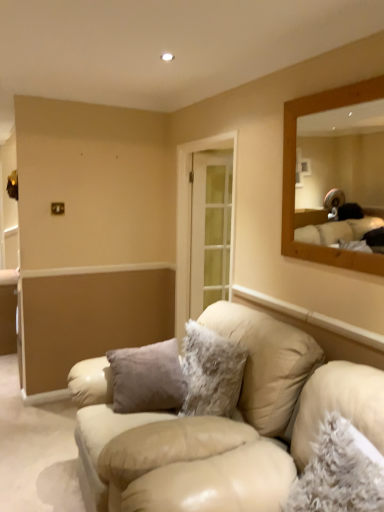
Question: From the image's perspective, is fuzzy gray pillow at lower right, the first pillow in the front-to-back sequence, under beige leather couch at center?

Choices:
 (A) yes
 (B) no

Answer: (B)

Question: From a real-world perspective, is fuzzy gray pillow at lower right, which is counted as the 2th pillow, starting from the left, located higher than beige leather couch at center?

Choices:
 (A) yes
 (B) no

Answer: (A)

Question: Is fuzzy gray pillow at lower right, positioned as the 1th pillow in right-to-left order, facing away from beige leather couch at center?

Choices:
 (A) no
 (B) yes

Answer: (A)

Question: Does fuzzy gray pillow at lower right, the first pillow in the front-to-back sequence, have a lesser width compared to beige leather couch at center?

Choices:
 (A) yes
 (B) no

Answer: (A)

Question: Considering the relative sizes of fuzzy gray pillow at lower right, which is counted as the 2th pillow, starting from the left, and beige leather couch at center in the image provided, is fuzzy gray pillow at lower right, which is counted as the 2th pillow, starting from the left, shorter than beige leather couch at center?

Choices:
 (A) yes
 (B) no

Answer: (A)

Question: From the image's perspective, relative to fuzzy gray pillow at lower right, the first pillow in the front-to-back sequence, is beige leather couch at center above or below?

Choices:
 (A) above
 (B) below

Answer: (B)

Question: Is beige leather couch at center spatially inside fuzzy gray pillow at lower right, which is the second pillow from back to front, or outside of it?

Choices:
 (A) inside
 (B) outside

Answer: (B)

Question: Looking at their shapes, would you say beige leather couch at center is wider or thinner than fuzzy gray pillow at lower right, positioned as the 1th pillow in right-to-left order?

Choices:
 (A) thin
 (B) wide

Answer: (B)

Question: From a real-world perspective, is beige leather couch at center physically located above or below fuzzy gray pillow at lower right, the first pillow in the front-to-back sequence?

Choices:
 (A) above
 (B) below

Answer: (B)

Question: From the image's perspective, is beige leather couch at center positioned above or below fuzzy white pillow at center, the second pillow from the front?

Choices:
 (A) below
 (B) above

Answer: (A)

Question: Based on their positions, is beige leather couch at center located to the left or right of fuzzy white pillow at center, the second pillow positioned from the right?

Choices:
 (A) right
 (B) left

Answer: (B)

Question: Is point (284, 422) closer or farther from the camera than point (205, 365)?

Choices:
 (A) farther
 (B) closer

Answer: (B)

Question: Considering their positions, is beige leather couch at center located in front of or behind fuzzy white pillow at center, marked as the first pillow in a back-to-front arrangement?

Choices:
 (A) behind
 (B) front

Answer: (B)

Question: Does point (331, 430) appear closer or farther from the camera than point (377, 420)?

Choices:
 (A) farther
 (B) closer

Answer: (A)

Question: From the image's perspective, is fuzzy gray pillow at lower right, which is counted as the 2th pillow, starting from the left, positioned above or below beige leather couch at center?

Choices:
 (A) above
 (B) below

Answer: (A)